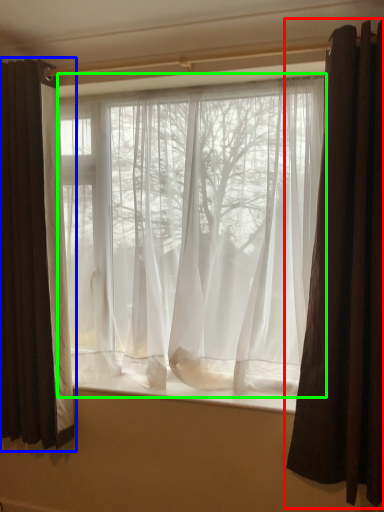
Question: Which object is the farthest from curtain (highlighted by a red box)? Choose among these: curtain (highlighted by a blue box) or curtain (highlighted by a green box).

Choices:
 (A) curtain
 (B) curtain

Answer: (A)